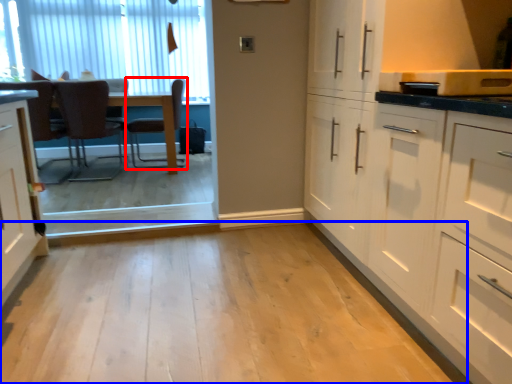
Question: Which of the following is the closest to the observer, chair (highlighted by a red box) or plain (highlighted by a blue box)?

Choices:
 (A) chair
 (B) plain

Answer: (B)